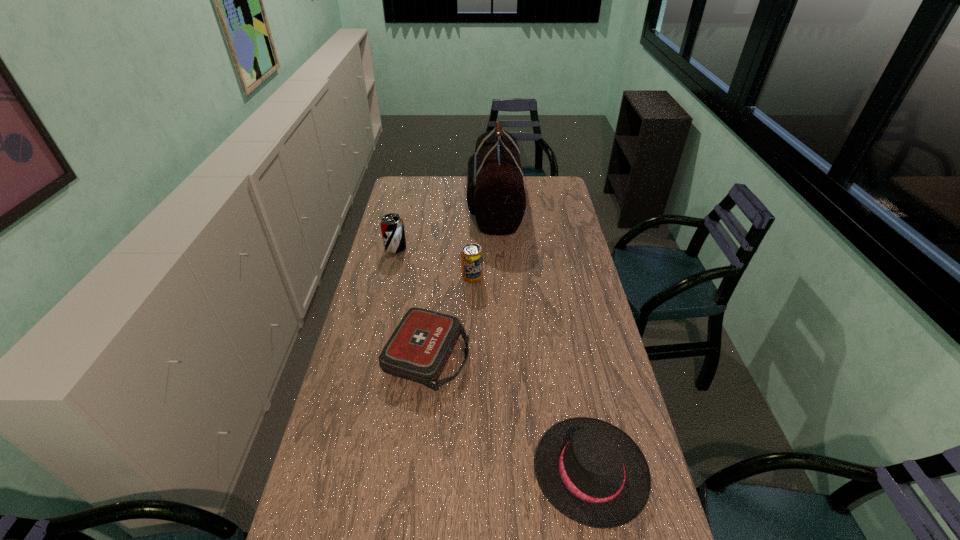
At what (x,y) coordinates should I click in order to perform the action: click on vacant space at the far edge. Please return your answer as a coordinate pair (x, y). The height and width of the screenshot is (540, 960). Looking at the image, I should click on (442, 177).

The height and width of the screenshot is (540, 960). I want to click on vacant space at the left edge, so click(361, 427).

In the image, there is a desktop. Identify the location of blank space at the right edge. The image size is (960, 540). (582, 360).

Where is `vacant space at the far right corner of the desktop`? vacant space at the far right corner of the desktop is located at coordinates (553, 178).

At what (x,y) coordinates should I click in order to perform the action: click on vacant space that's between the first-aid kit and the farthest object. Please return your answer as a coordinate pair (x, y). Looking at the image, I should click on (461, 280).

This screenshot has width=960, height=540. I want to click on empty space that is in between the second nearest object and the duffel bag, so click(x=461, y=280).

In order to click on empty space between the dress hat and the right soda can in this screenshot , I will do `click(532, 375)`.

The image size is (960, 540). In order to click on free space between the farther soda can and the nearest object in this screenshot , I will do `click(493, 360)`.

Find the location of a particular element. unoccupied position between the dress hat and the first-aid kit is located at coordinates (509, 414).

You are a GUI agent. You are given a task and a screenshot of the screen. Output one action in this format:
    pyautogui.click(x=<x>, y=<y>)
    Task: Click on the vacant area that lies between the right soda can and the tallest object
    This screenshot has width=960, height=540.
    Given the screenshot: What is the action you would take?
    pyautogui.click(x=483, y=241)